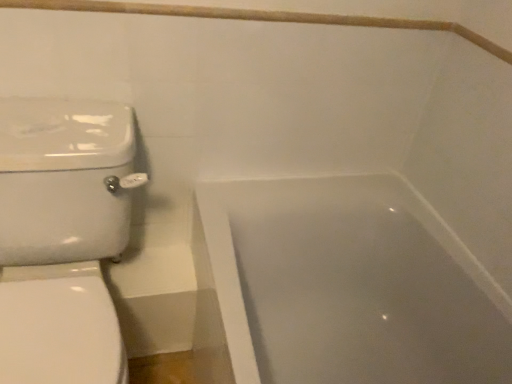
Question: Is point (78, 157) closer or farther from the camera than point (153, 8)?

Choices:
 (A) farther
 (B) closer

Answer: (B)

Question: Based on their positions, is white glossy toilet at left located to the left or right of wooden balustrade at upper center?

Choices:
 (A) right
 (B) left

Answer: (B)

Question: Estimate the real-world distances between objects in this image. Which object is closer to the wooden balustrade at upper center?

Choices:
 (A) white glossy bathtub at lower right
 (B) white glossy toilet at left

Answer: (B)

Question: Which object is positioned farthest from the white glossy toilet at left?

Choices:
 (A) white glossy bathtub at lower right
 (B) wooden balustrade at upper center

Answer: (A)